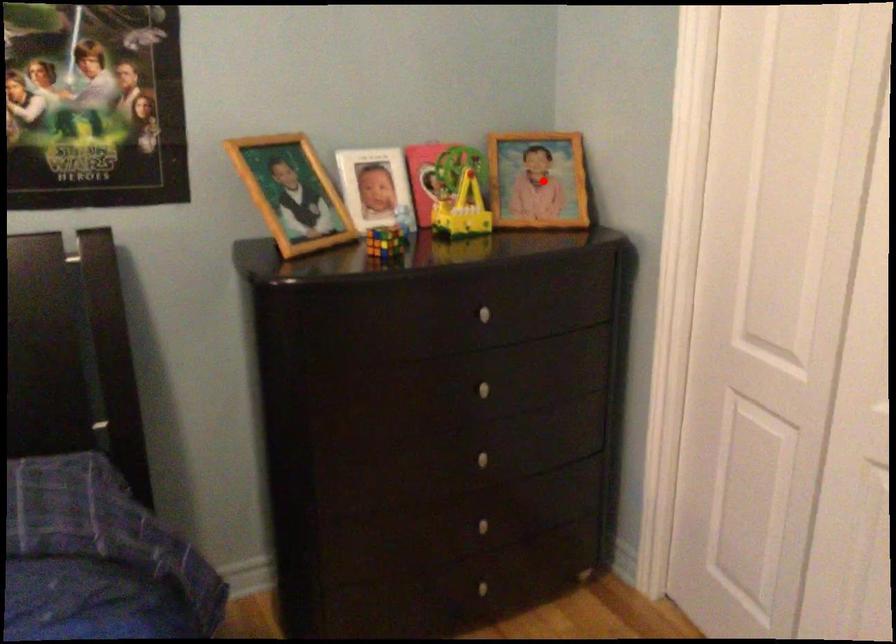
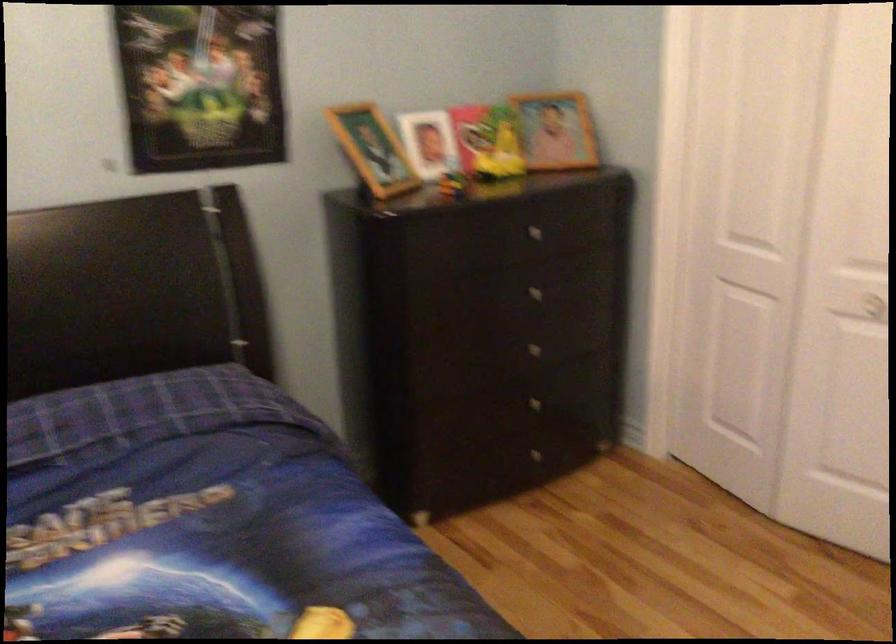
Question: I am providing you with two images of the same scene from different viewpoints. In image1, a red point is highlighted. Considering the same 3D point in image2, which of the following is correct?

Choices:
 (A) It is closer
 (B) It is farther

Answer: (B)